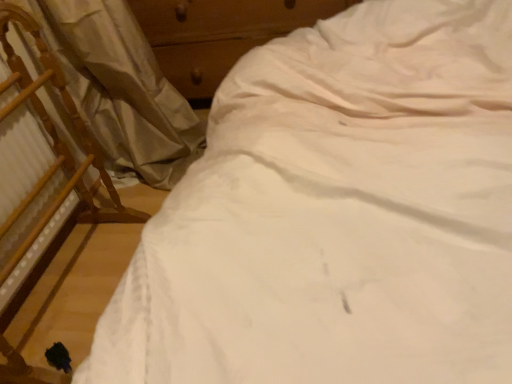
Question: Is white fabric curtain at left closer to camera compared to wooden chair at left?

Choices:
 (A) yes
 (B) no

Answer: (B)

Question: Could you tell me if white fabric curtain at left is turned towards wooden chair at left?

Choices:
 (A) yes
 (B) no

Answer: (B)

Question: Does white fabric curtain at left have a lesser width compared to wooden chair at left?

Choices:
 (A) no
 (B) yes

Answer: (A)

Question: Is white fabric curtain at left shorter than wooden chair at left?

Choices:
 (A) yes
 (B) no

Answer: (A)

Question: Is white fabric curtain at left positioned far away from wooden chair at left?

Choices:
 (A) yes
 (B) no

Answer: (B)

Question: Is wooden dresser at upper center in front of or behind wooden chair at left in the image?

Choices:
 (A) front
 (B) behind

Answer: (B)

Question: Considering the positions of wooden dresser at upper center and wooden chair at left in the image, is wooden dresser at upper center bigger or smaller than wooden chair at left?

Choices:
 (A) small
 (B) big

Answer: (B)

Question: In the image, is wooden dresser at upper center on the left side or the right side of wooden chair at left?

Choices:
 (A) right
 (B) left

Answer: (A)

Question: Considering the positions of wooden dresser at upper center and wooden chair at left in the image, is wooden dresser at upper center wider or thinner than wooden chair at left?

Choices:
 (A) thin
 (B) wide

Answer: (B)

Question: Is wooden dresser at upper center in front of or behind white fabric curtain at left in the image?

Choices:
 (A) front
 (B) behind

Answer: (B)

Question: From the image's perspective, is wooden dresser at upper center above or below white fabric curtain at left?

Choices:
 (A) below
 (B) above

Answer: (B)

Question: From a real-world perspective, is wooden dresser at upper center positioned above or below white fabric curtain at left?

Choices:
 (A) above
 (B) below

Answer: (B)

Question: Visually, is wooden dresser at upper center positioned to the left or to the right of white fabric curtain at left?

Choices:
 (A) left
 (B) right

Answer: (B)

Question: Considering the positions of wooden chair at left and white fabric curtain at left in the image, is wooden chair at left bigger or smaller than white fabric curtain at left?

Choices:
 (A) big
 (B) small

Answer: (B)

Question: From a real-world perspective, relative to white fabric curtain at left, is wooden chair at left vertically above or below?

Choices:
 (A) below
 (B) above

Answer: (B)